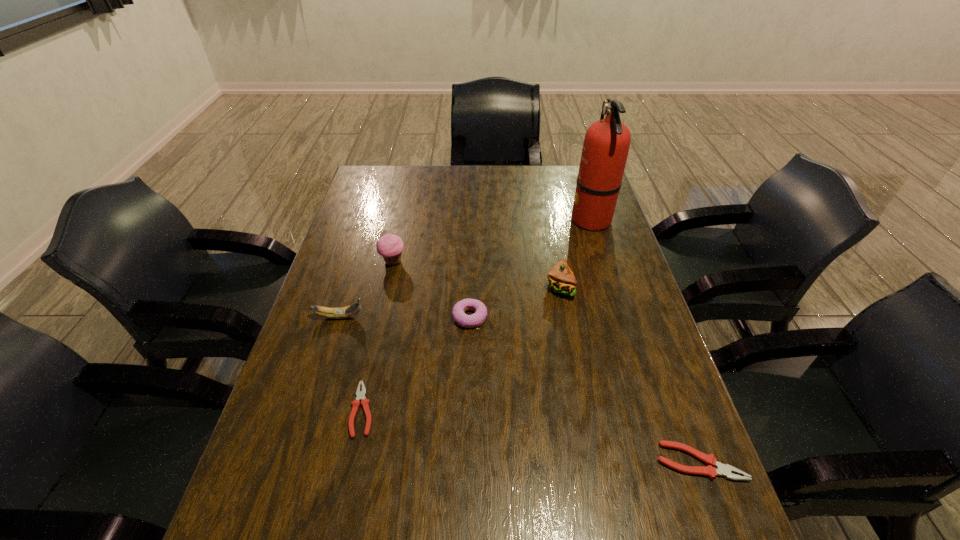
Where is `free space between the nearest object and the fourth shortest object`? This screenshot has height=540, width=960. free space between the nearest object and the fourth shortest object is located at coordinates (519, 389).

Where is `vacant area between the nearer pliers and the sandwich`? vacant area between the nearer pliers and the sandwich is located at coordinates (630, 374).

Locate an element on the screen. This screenshot has height=540, width=960. vacant region between the tallest object and the nearer pliers is located at coordinates (645, 341).

Find the location of a particular element. free spot between the third object from right to left and the third shortest object is located at coordinates (515, 302).

This screenshot has height=540, width=960. I want to click on object identified as the second closest to the fifth tallest object, so click(x=390, y=246).

Find the location of a particular element. The width and height of the screenshot is (960, 540). object that can be found as the second closest to the fire extinguisher is located at coordinates (476, 319).

I want to click on blank area in the image that satisfies the following two spatial constraints: 1. on the peel of the leftmost object; 2. on the left side of the second shortest object, so click(295, 462).

This screenshot has width=960, height=540. I want to click on vacant region that satisfies the following two spatial constraints: 1. on the side of the farthest object with the nozzle and handle; 2. on the front side of the sandwich, so click(x=612, y=287).

This screenshot has width=960, height=540. In order to click on vacant space that satisfies the following two spatial constraints: 1. on the peel of the leftmost object; 2. on the left side of the shortest object in this screenshot , I will do `click(311, 409)`.

Identify the location of free space that satisfies the following two spatial constraints: 1. on the back side of the sixth farthest object; 2. on the peel of the leftmost object. This screenshot has width=960, height=540. click(383, 317).